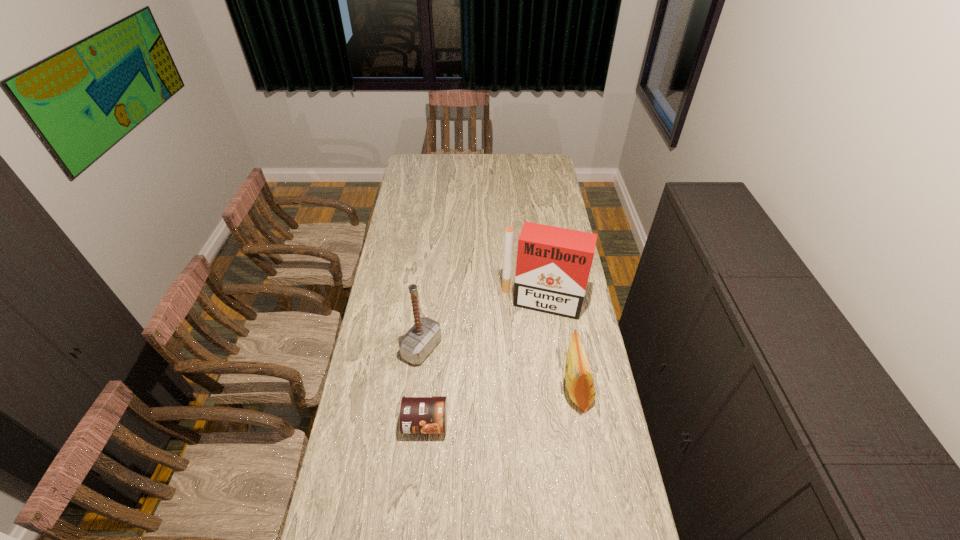
This screenshot has width=960, height=540. In order to click on vacant area located 0.170m on the striking surface of the third nearest object in this screenshot , I will do `click(475, 379)`.

Locate an element on the screen. The width and height of the screenshot is (960, 540). object that is at the left edge is located at coordinates (425, 334).

The height and width of the screenshot is (540, 960). What are the coordinates of `crisp (potato chip) that is at the right edge` in the screenshot? It's located at (579, 380).

Identify the location of cigarette case at the right edge. This screenshot has height=540, width=960. (553, 265).

The width and height of the screenshot is (960, 540). Find the location of `vacant area at the left edge of the desktop`. vacant area at the left edge of the desktop is located at coordinates (372, 427).

Locate an element on the screen. The image size is (960, 540). free space at the right edge is located at coordinates (550, 188).

This screenshot has height=540, width=960. Find the location of `vacant space at the far right corner`. vacant space at the far right corner is located at coordinates (553, 161).

The image size is (960, 540). I want to click on vacant space that's between the second farthest object and the second shortest object, so (x=499, y=369).

Locate an element on the screen. This screenshot has width=960, height=540. blank region between the shortest object and the hammer is located at coordinates (423, 386).

The width and height of the screenshot is (960, 540). I want to click on free space between the crisp (potato chip) and the hammer, so click(499, 369).